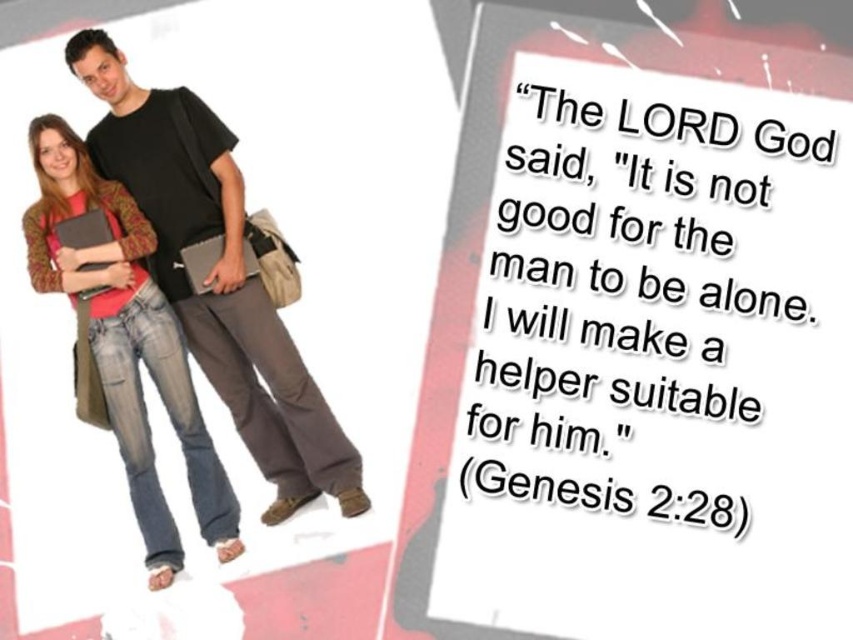
Between point (129, 168) and point (50, 289), which one is positioned in front?

Point (50, 289)

Does point (200, 332) come behind point (143, 316)?

Yes.

Is point (154, 90) positioned before point (144, 481)?

No, (154, 90) is behind (144, 481).

You are a GUI agent. You are given a task and a screenshot of the screen. Output one action in this format:
    pyautogui.click(x=<x>, y=<y>)
    Task: Click on the black matte t-shirt at center
    The image size is (853, 640).
    Given the screenshot: What is the action you would take?
    pyautogui.click(x=216, y=276)